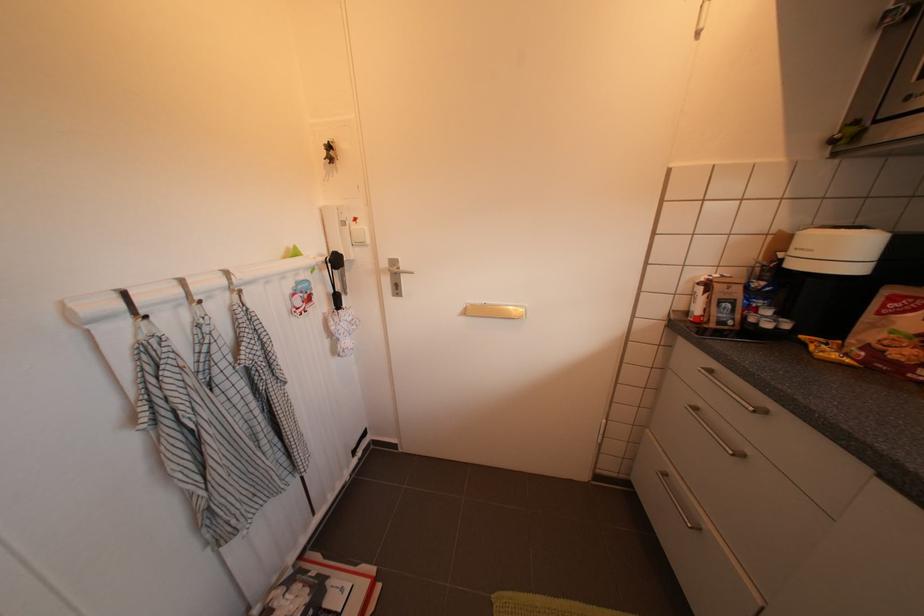
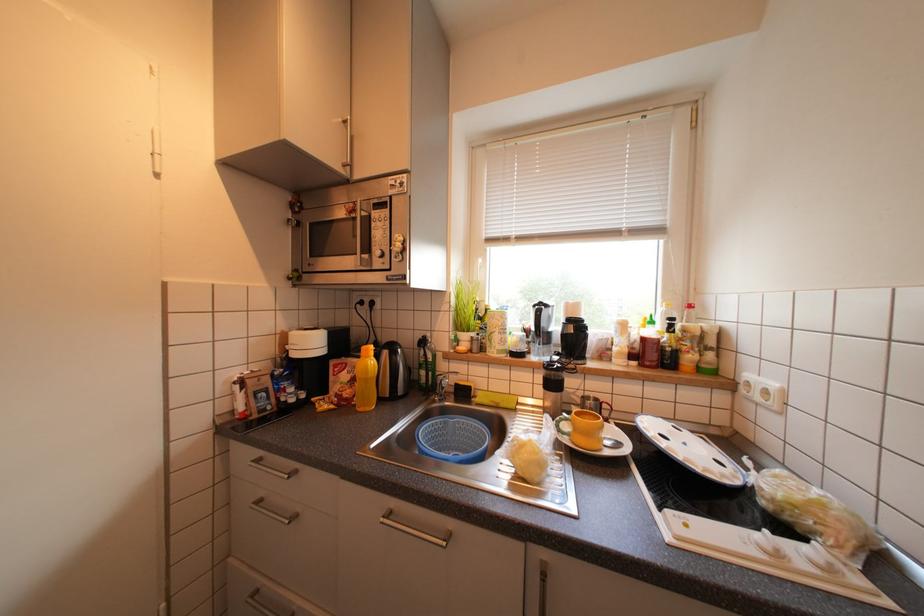
Question: The camera is either moving clockwise (left) or counter-clockwise (right) around the object. The first image is from the beginning of the video and the second image is from the end. Is the camera moving left or right when shooting the video?

Choices:
 (A) Left
 (B) Right

Answer: (A)